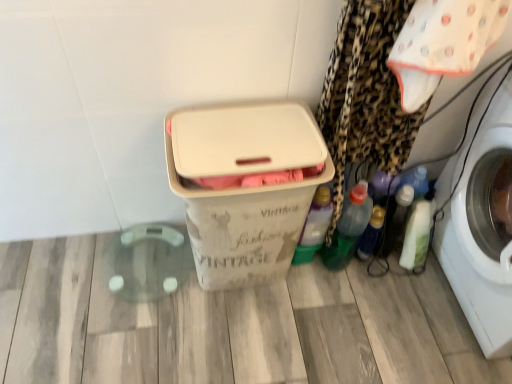
Question: From a real-world perspective, relative to translucent plastic bottle at lower right, the second bottle in the right-to-left sequence, is green translucent bottle at center-right, the first bottle positioned from the left, vertically above or below?

Choices:
 (A) below
 (B) above

Answer: (B)

Question: Is point (330, 211) closer or farther from the camera than point (371, 243)?

Choices:
 (A) farther
 (B) closer

Answer: (B)

Question: Based on their relative distances, which object is nearer to the leopard print fabric at right?

Choices:
 (A) white plastic washing machine at right
 (B) translucent plastic bottle at lower right, the 3th bottle positioned from the left
 (C) white glossy bottle at lower right, marked as the fourth bottle in a left-to-right arrangement
 (D) beige plastic storage box at center
 (E) green translucent bottle at center-right, the first bottle positioned from the left

Answer: (E)

Question: Based on their relative distances, which object is farther from the green plastic bottle at lower right, the 3th bottle viewed from the right?

Choices:
 (A) white glossy bottle at lower right, placed as the first bottle when sorted from right to left
 (B) translucent plastic bottle at lower right, the 3th bottle positioned from the left
 (C) green translucent bottle at center-right, which is counted as the fourth bottle, starting from the right
 (D) white cotton cloth at upper right
 (E) beige plastic storage box at center

Answer: (D)